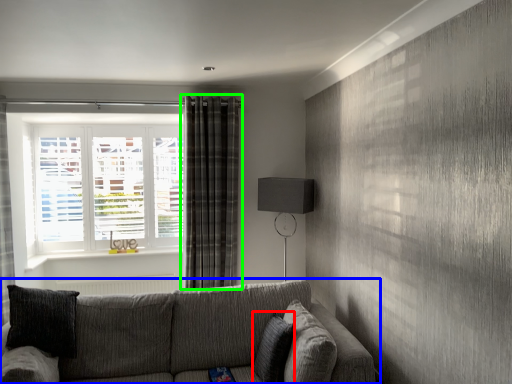
Question: Which object is positioned farthest from pillow (highlighted by a red box)? Select from studio couch (highlighted by a blue box) and curtain (highlighted by a green box).

Choices:
 (A) studio couch
 (B) curtain

Answer: (B)